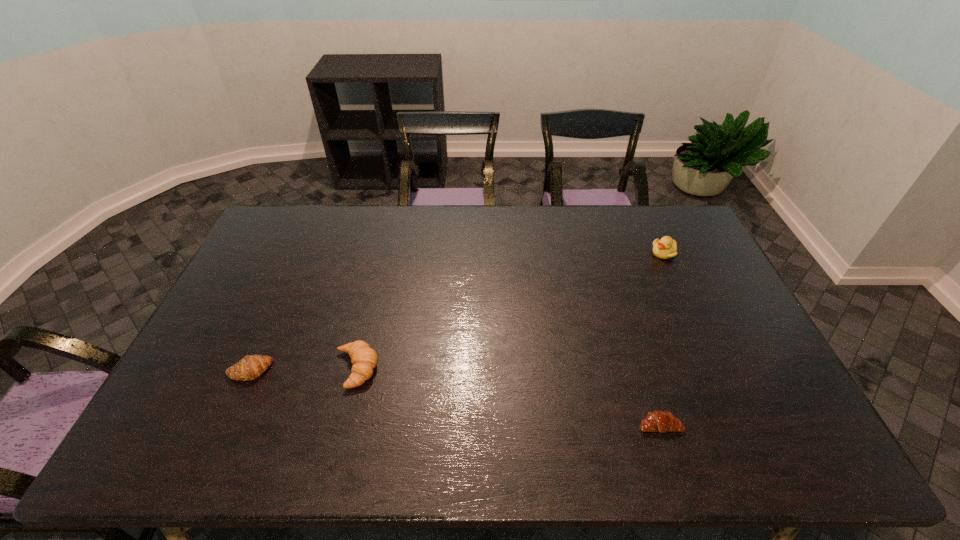
Find the location of `empty location between the duckling and the second object from left to right`. empty location between the duckling and the second object from left to right is located at coordinates (510, 311).

This screenshot has height=540, width=960. I want to click on free space between the second shortest crescent roll and the shortest crescent roll, so click(x=454, y=397).

I want to click on vacant space in between the duckling and the tallest crescent roll, so click(510, 311).

Where is `free point between the third tallest object and the tallest object`? This screenshot has height=540, width=960. free point between the third tallest object and the tallest object is located at coordinates (457, 312).

Where is `free point between the tallest crescent roll and the third tallest object`? This screenshot has height=540, width=960. free point between the tallest crescent roll and the third tallest object is located at coordinates (302, 370).

Identify the location of object that is the closest to the rightmost object. The image size is (960, 540). pos(660,421).

Identify which object is located as the nearest to the shortest object. Please provide its 2D coordinates. Your answer should be formatted as a tuple, i.e. [(x, y)], where the tuple contains the x and y coordinates of a point satisfying the conditions above.

[(665, 248)]

In order to click on crescent roll that can be found as the second closest to the tallest object in this screenshot , I will do `click(363, 358)`.

At what (x,y) coordinates should I click in order to perform the action: click on crescent roll that is the closest to the shortest object. Please return your answer as a coordinate pair (x, y). Image resolution: width=960 pixels, height=540 pixels. Looking at the image, I should click on (363, 358).

Where is `vacant space that satisfies the following two spatial constraints: 1. on the beak of the tallest object; 2. on the front side of the third tallest object`? The image size is (960, 540). vacant space that satisfies the following two spatial constraints: 1. on the beak of the tallest object; 2. on the front side of the third tallest object is located at coordinates (717, 371).